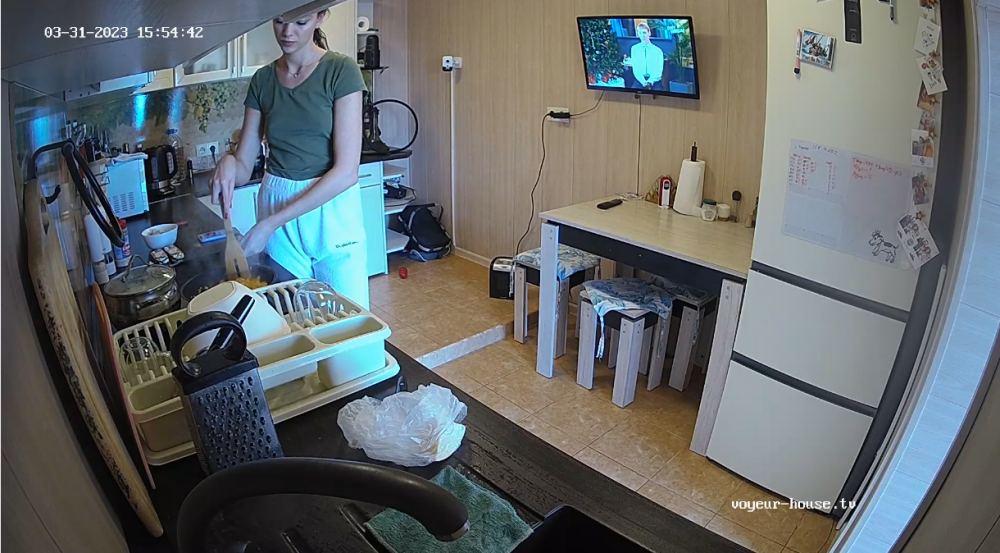
Locate an element on the screen. This screenshot has width=1000, height=553. mementos pinned to the wall is located at coordinates (903, 239), (918, 181), (922, 140), (928, 114), (928, 92), (931, 36), (923, 7), (809, 44), (834, 182).